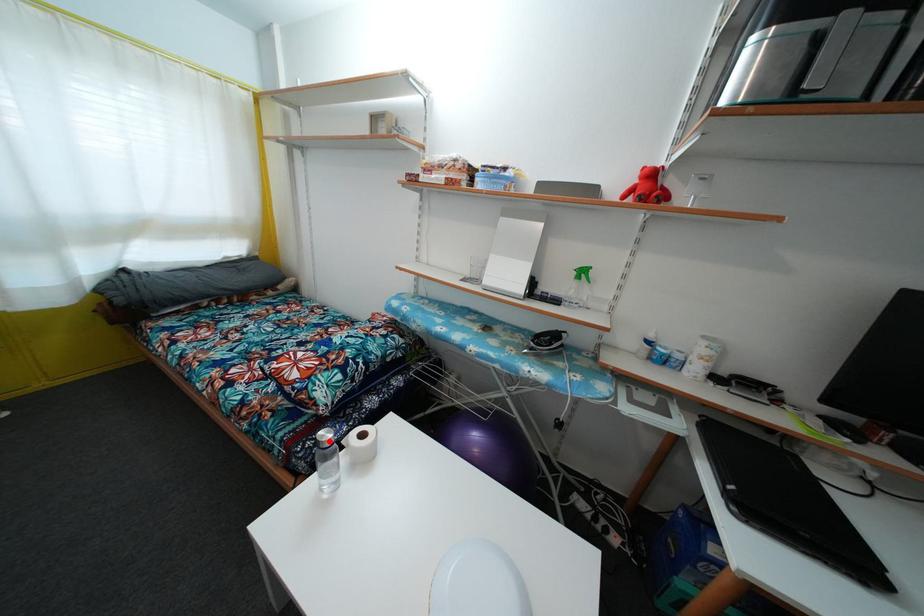
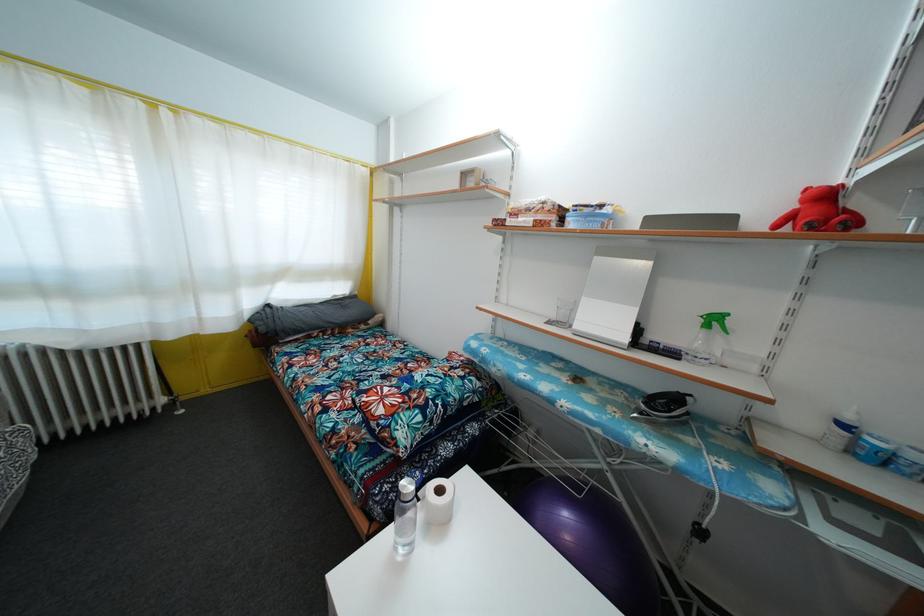
Where in the second image is the point corresponding to the highlighted location from the first image?

(410, 492)